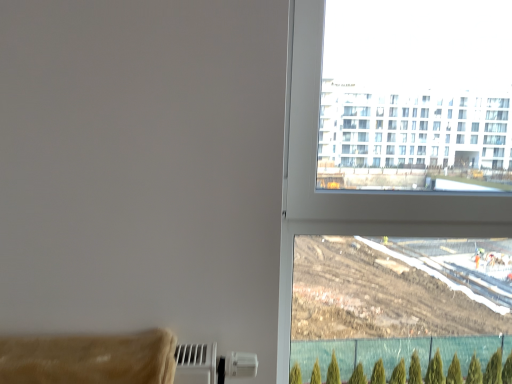
The width and height of the screenshot is (512, 384). What do you see at coordinates (350, 194) in the screenshot?
I see `transparent glass window at upper right` at bounding box center [350, 194].

Measure the distance between point (x=480, y=220) and camera.

They are 1.16 meters apart.

Identify the location of transparent glass window at upper right. The image size is (512, 384). (350, 194).

Where is `transparent glass window at upper right`? transparent glass window at upper right is located at coordinates (350, 194).